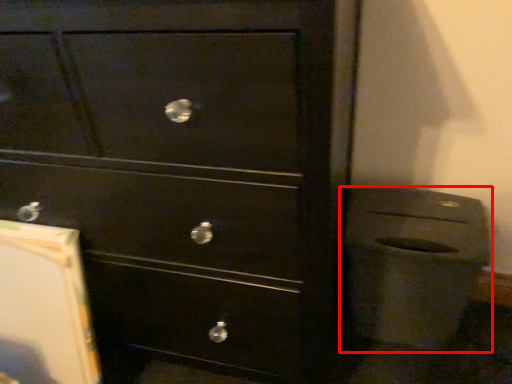
Question: From the image's perspective, where is waste container (annotated by the red box) located relative to chest of drawers?

Choices:
 (A) above
 (B) below

Answer: (B)